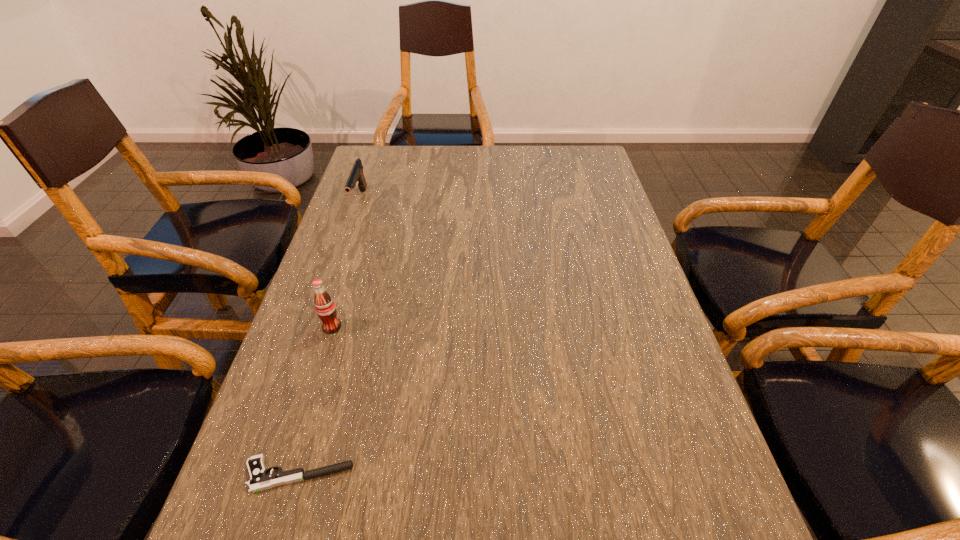
Where is `empty space between the nearer pistol and the soda`? Image resolution: width=960 pixels, height=540 pixels. empty space between the nearer pistol and the soda is located at coordinates (315, 401).

Find the location of a particular element. This screenshot has width=960, height=540. vacant area that lies between the second shortest object and the soda is located at coordinates (346, 264).

Point out which object is positioned as the second nearest to the nearest object. Please provide its 2D coordinates. Your answer should be formatted as a tuple, i.e. [(x, y)], where the tuple contains the x and y coordinates of a point satisfying the conditions above.

[(356, 175)]

Locate an element on the screen. The image size is (960, 540). object that stands as the closest to the second tallest object is located at coordinates (325, 307).

Image resolution: width=960 pixels, height=540 pixels. Identify the location of vacant point that satisfies the following two spatial constraints: 1. at the muzzle of the taller pistol; 2. on the left side of the second nearest object. (317, 327).

Where is `vacant space that satisfies the following two spatial constraints: 1. at the muzzle of the soda; 2. on the left side of the farthest object`? Image resolution: width=960 pixels, height=540 pixels. vacant space that satisfies the following two spatial constraints: 1. at the muzzle of the soda; 2. on the left side of the farthest object is located at coordinates (317, 327).